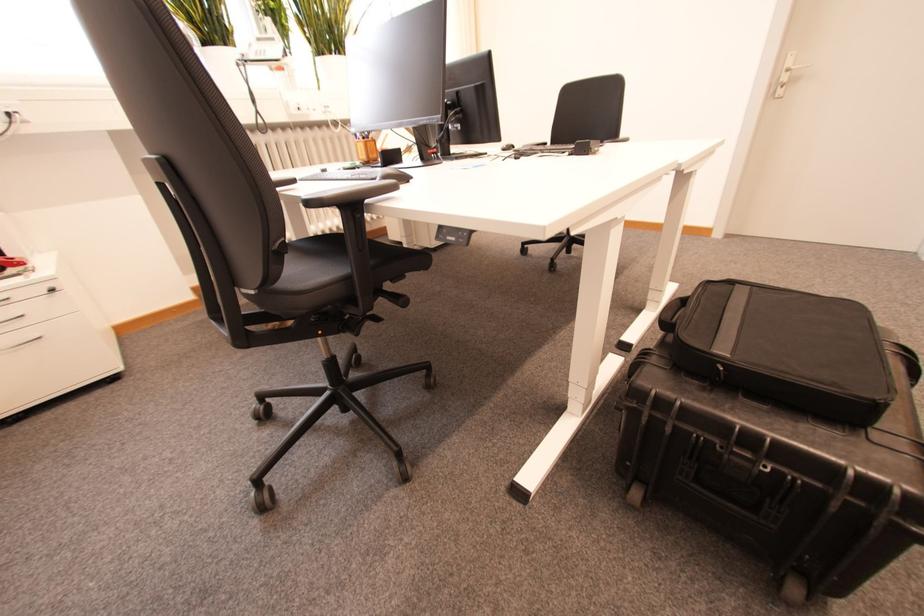
At what (x,y) coordinates should I click in order to perform the action: click on black chair sitting surface. Please return your answer as a coordinate pair (x, y). The width and height of the screenshot is (924, 616). Looking at the image, I should click on (313, 254).